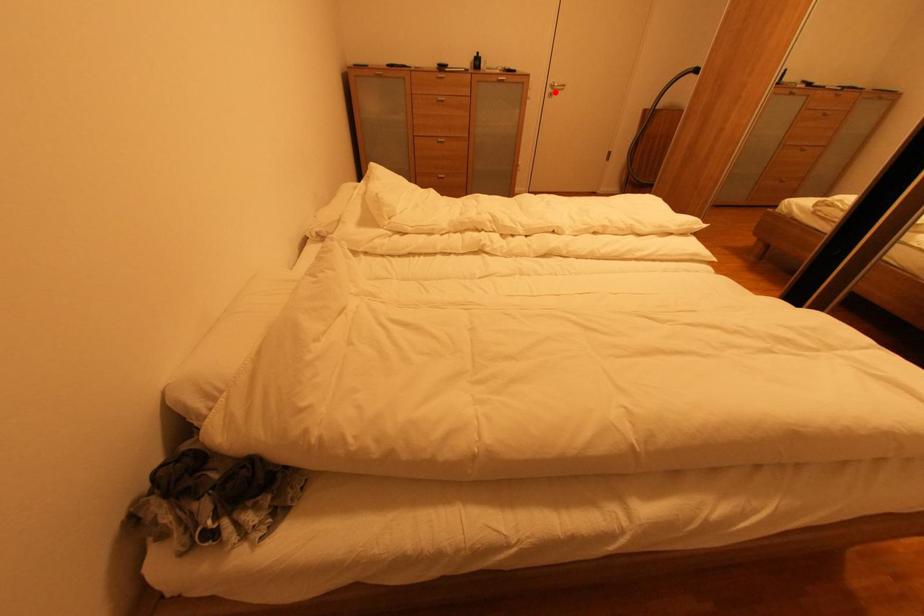
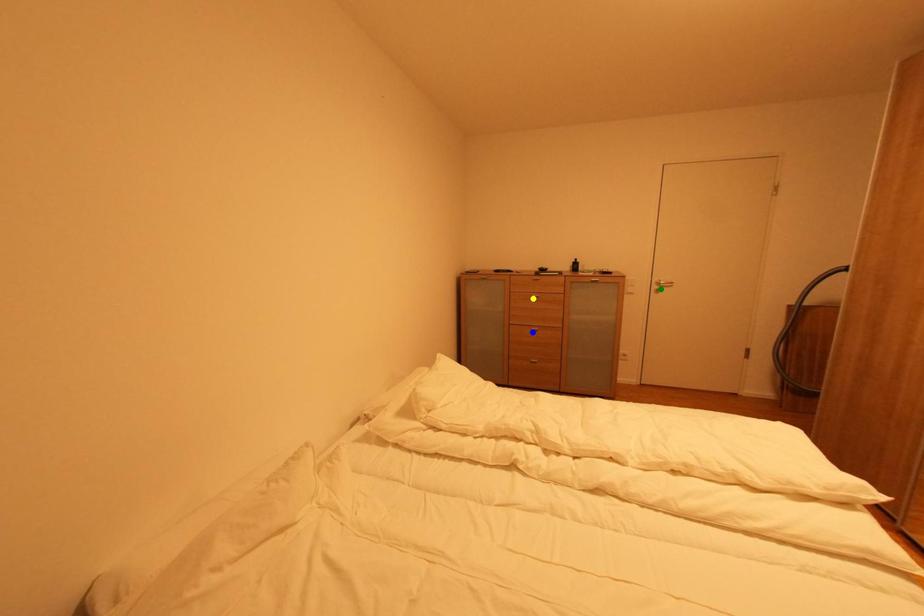
Question: I am providing you with two images of the same scene from different viewpoints. A red point is marked on the first image. You are given multiple points on the second image. Can you choose the point in image 2 that corresponds to the point in image 1?

Choices:
 (A) yellow point
 (B) blue point
 (C) green point

Answer: (C)